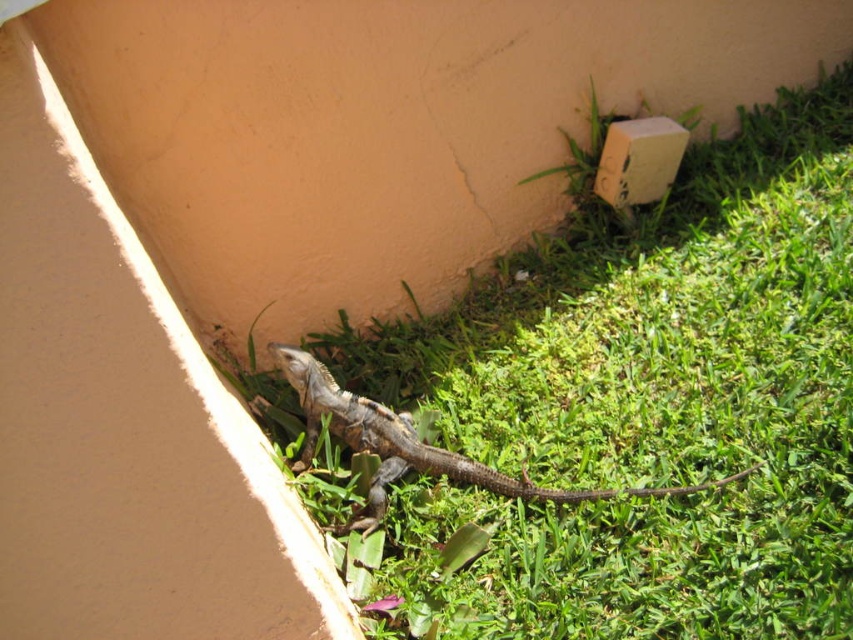
Question: Where is brown scaly lizard at lower center located in relation to beige cardboard box at upper right in the image?

Choices:
 (A) above
 (B) below

Answer: (B)

Question: Which object is positioned closest to the beige cardboard box at upper right?

Choices:
 (A) brown scaly lizard at lower center
 (B) green grass at lower center

Answer: (B)

Question: In this image, where is green grass at lower center located relative to brown scaly lizard at lower center?

Choices:
 (A) left
 (B) right

Answer: (B)

Question: Is green grass at lower center wider than beige cardboard box at upper right?

Choices:
 (A) no
 (B) yes

Answer: (B)

Question: Which object is farther from the camera taking this photo?

Choices:
 (A) green grass at lower center
 (B) brown scaly lizard at lower center

Answer: (B)

Question: Among these points, which one is nearest to the camera?

Choices:
 (A) (310, 362)
 (B) (634, 147)
 (C) (509, 305)

Answer: (A)